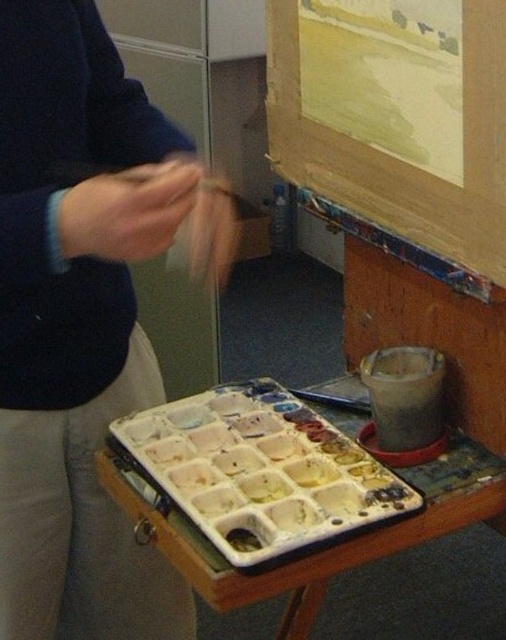
Question: Can you confirm if matte black sweater at upper left is bigger than white matte plastic tray at lower center?

Choices:
 (A) yes
 (B) no

Answer: (A)

Question: Which point is closer to the camera?

Choices:
 (A) matte black sweater at upper left
 (B) white matte plastic tray at lower center

Answer: (A)

Question: Which point is farther from the camera taking this photo?

Choices:
 (A) (15, 419)
 (B) (263, 444)

Answer: (B)

Question: Is matte black sweater at upper left bigger than white matte plastic tray at lower center?

Choices:
 (A) no
 (B) yes

Answer: (B)

Question: Is the position of matte black sweater at upper left less distant than that of white matte plastic tray at lower center?

Choices:
 (A) yes
 (B) no

Answer: (A)